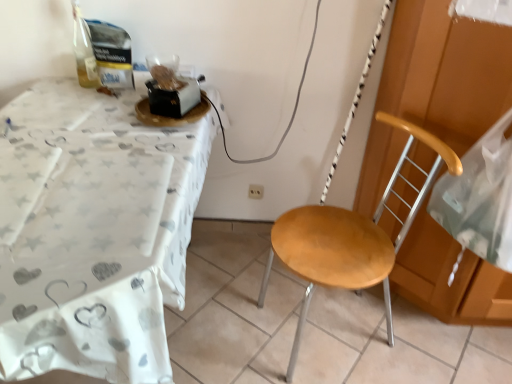
Question: From the image's perspective, is transparent plastic bag at right under white plastic power outlet at center?

Choices:
 (A) no
 (B) yes

Answer: (A)

Question: Does transparent plastic bag at right turn towards white plastic power outlet at center?

Choices:
 (A) no
 (B) yes

Answer: (A)

Question: Is transparent plastic bag at right not near white plastic power outlet at center?

Choices:
 (A) no
 (B) yes

Answer: (A)

Question: Is transparent plastic bag at right wider than white plastic power outlet at center?

Choices:
 (A) no
 (B) yes

Answer: (B)

Question: Does transparent plastic bag at right come in front of white plastic power outlet at center?

Choices:
 (A) yes
 (B) no

Answer: (A)

Question: From their relative heights in the image, would you say white plastic power outlet at center is taller or shorter than transparent plastic bag at right?

Choices:
 (A) tall
 (B) short

Answer: (B)

Question: Is white plastic power outlet at center bigger or smaller than transparent plastic bag at right?

Choices:
 (A) small
 (B) big

Answer: (A)

Question: From a real-world perspective, is white plastic power outlet at center physically located above or below transparent plastic bag at right?

Choices:
 (A) below
 (B) above

Answer: (A)

Question: Is point (261, 195) closer or farther from the camera than point (495, 178)?

Choices:
 (A) closer
 (B) farther

Answer: (B)

Question: From a real-world perspective, is wooden seat at center above or below transparent plastic bag at right?

Choices:
 (A) above
 (B) below

Answer: (B)

Question: Is wooden seat at center taller or shorter than transparent plastic bag at right?

Choices:
 (A) short
 (B) tall

Answer: (B)

Question: From the image's perspective, is wooden seat at center above or below transparent plastic bag at right?

Choices:
 (A) above
 (B) below

Answer: (B)

Question: Do you think wooden seat at center is within transparent plastic bag at right, or outside of it?

Choices:
 (A) outside
 (B) inside

Answer: (A)

Question: Is white fabric table at left inside the boundaries of wooden seat at center, or outside?

Choices:
 (A) inside
 (B) outside

Answer: (B)

Question: Looking at the image, does white fabric table at left seem bigger or smaller compared to wooden seat at center?

Choices:
 (A) big
 (B) small

Answer: (A)